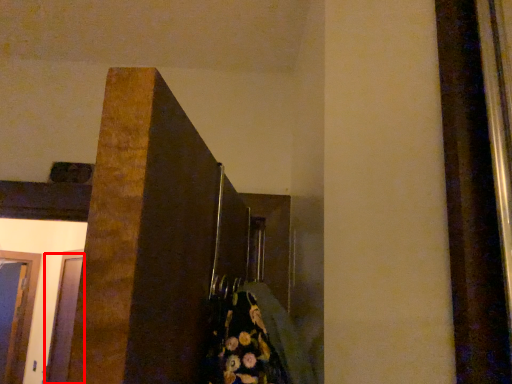
Question: From the image's perspective, what is the correct spatial relationship of glass door (annotated by the red box) in relation to glass door?

Choices:
 (A) above
 (B) below

Answer: (A)